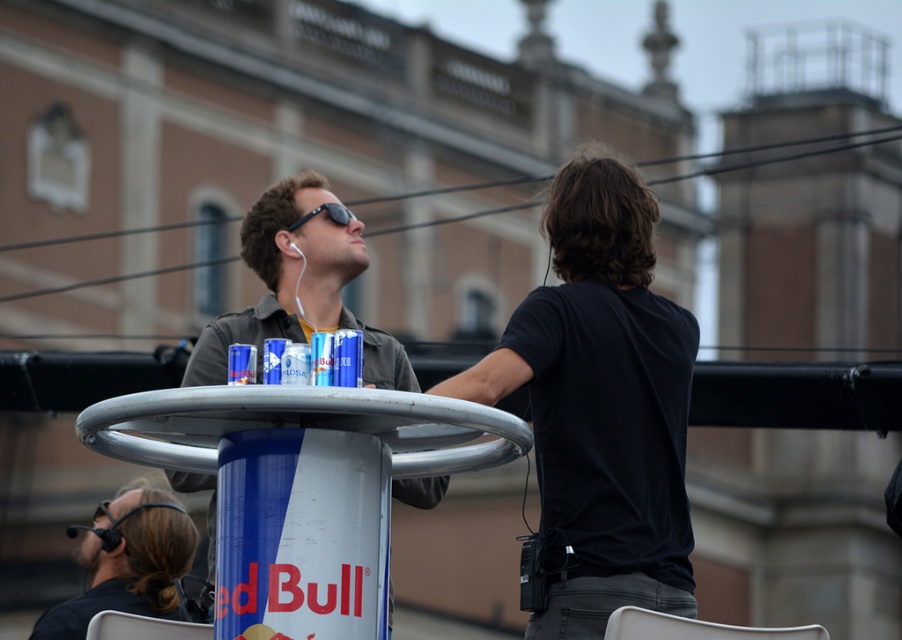
Between matte black jacket at center and brown hair at lower left, which one has more height?

Standing taller between the two is matte black jacket at center.

Who is positioned more to the right, matte black jacket at center or brown hair at lower left?

matte black jacket at center is more to the right.

This screenshot has height=640, width=902. What do you see at coordinates (299, 284) in the screenshot?
I see `matte black jacket at center` at bounding box center [299, 284].

The image size is (902, 640). Find the location of `matte black jacket at center`. matte black jacket at center is located at coordinates (299, 284).

Between black matte shirt at center and brown hair at lower left, which one is positioned lower?

brown hair at lower left is below.

Is black matte shirt at center positioned at the back of brown hair at lower left?

No, black matte shirt at center is in front of brown hair at lower left.

Is point (629, 337) more distant than point (122, 513)?

No, it is in front of (122, 513).

The height and width of the screenshot is (640, 902). Find the location of `black matte shirt at center`. black matte shirt at center is located at coordinates (600, 404).

At what (x,y) coordinates should I click in order to perform the action: click on black matte shirt at center. Please return your answer as a coordinate pair (x, y). This screenshot has width=902, height=640. Looking at the image, I should click on (600, 404).

Is black matte shirt at center behind matte black jacket at center?

That is True.

Identify the location of black matte shirt at center. [600, 404].